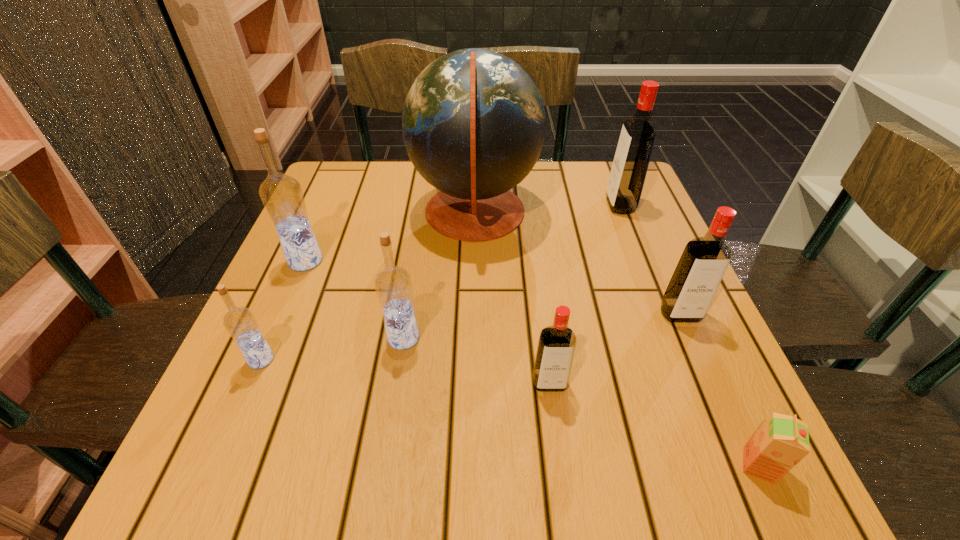
In order to click on vacant space situated 0.150m on the front and back of the fourth farthest object in this screenshot , I will do `click(715, 395)`.

The width and height of the screenshot is (960, 540). I want to click on free space located 0.080m on the front and back of the fourth vodka from left to right, so 557,440.

Locate an element on the screen. The height and width of the screenshot is (540, 960). free space located on the back of the smallest blue vodka is located at coordinates (314, 237).

I want to click on free region located on the back of the shortest object, so [717, 373].

Find the location of a particular element. The width and height of the screenshot is (960, 540). globe located in the far edge section of the desktop is located at coordinates (473, 123).

Find the location of a particular element. This screenshot has height=540, width=960. vodka that is at the far edge is located at coordinates (630, 164).

The image size is (960, 540). I want to click on object located in the near edge section of the desktop, so click(x=782, y=441).

You are a GUI agent. You are given a task and a screenshot of the screen. Output one action in this format:
    pyautogui.click(x=<x>, y=<y>)
    Task: Click on the orange juice that is at the right edge
    The width and height of the screenshot is (960, 540).
    Given the screenshot: What is the action you would take?
    pyautogui.click(x=782, y=441)

Where is `object at the far right corner`? Image resolution: width=960 pixels, height=540 pixels. object at the far right corner is located at coordinates (630, 164).

Where is `object at the near right corner`? object at the near right corner is located at coordinates (782, 441).